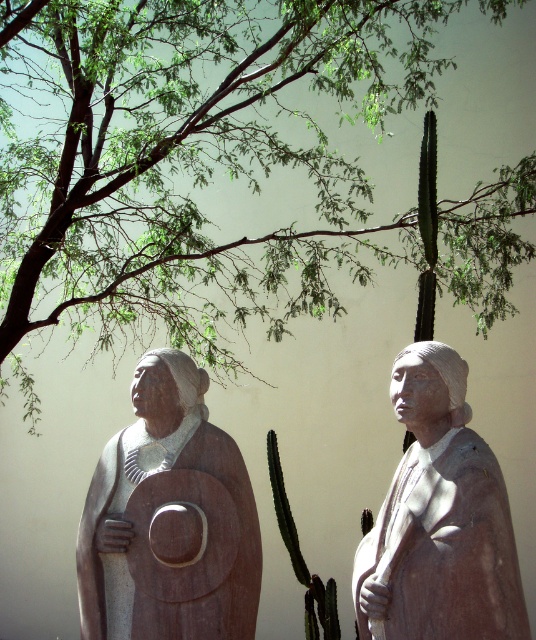
Question: Among these points, which one is nearest to the camera?

Choices:
 (A) (94, 570)
 (B) (397, 403)
 (C) (241, 161)

Answer: (B)

Question: Which of the following is the farthest from the observer?

Choices:
 (A) smooth beige statue at center
 (B) matte stone shield at left

Answer: (B)

Question: In this image, where is matte stone shield at left located relative to smooth beige statue at center?

Choices:
 (A) above
 (B) below

Answer: (B)

Question: Does matte stone shield at left appear over smooth beige statue at center?

Choices:
 (A) yes
 (B) no

Answer: (B)

Question: Can you confirm if green leafy tree at upper left is bigger than matte stone shield at left?

Choices:
 (A) yes
 (B) no

Answer: (A)

Question: Which of these objects is positioned closest to the smooth beige statue at center?

Choices:
 (A) matte stone shield at left
 (B) green leafy tree at upper left

Answer: (A)